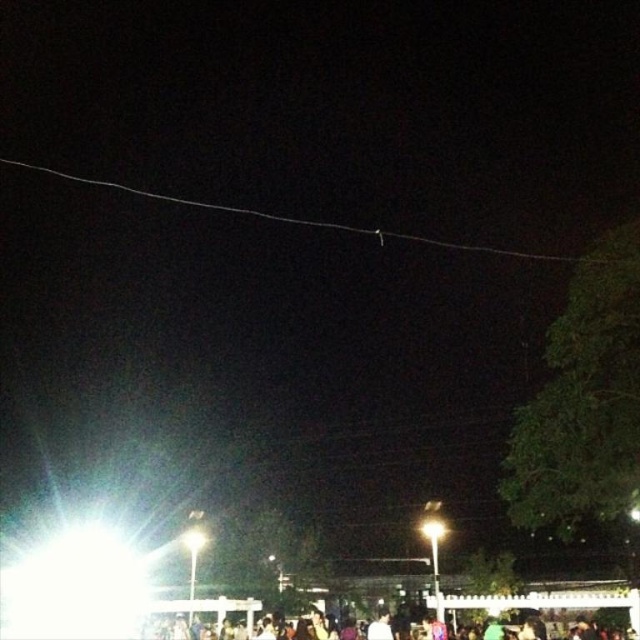
Question: Does white wire at upper center appear on the right side of dark clothing crowd at lower center?

Choices:
 (A) no
 (B) yes

Answer: (A)

Question: Which point is farther to the camera?

Choices:
 (A) pyautogui.click(x=547, y=596)
 (B) pyautogui.click(x=273, y=218)

Answer: (B)

Question: Does white wire at upper center have a larger size compared to dark clothing crowd at lower center?

Choices:
 (A) yes
 (B) no

Answer: (A)

Question: Which point is closer to the camera?

Choices:
 (A) tap(547, 256)
 (B) tap(582, 596)

Answer: (B)

Question: Does white wire at upper center lie behind dark clothing crowd at lower center?

Choices:
 (A) no
 (B) yes

Answer: (A)

Question: Which point is farther from the camera taking this photo?

Choices:
 (A) (92, 184)
 (B) (540, 604)

Answer: (A)